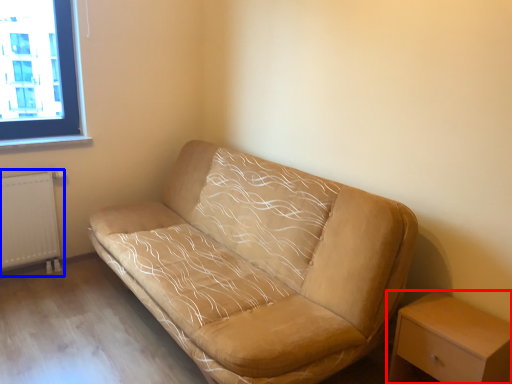
Question: Which object is closer to the camera taking this photo, nightstand (highlighted by a red box) or radiator (highlighted by a blue box)?

Choices:
 (A) nightstand
 (B) radiator

Answer: (A)